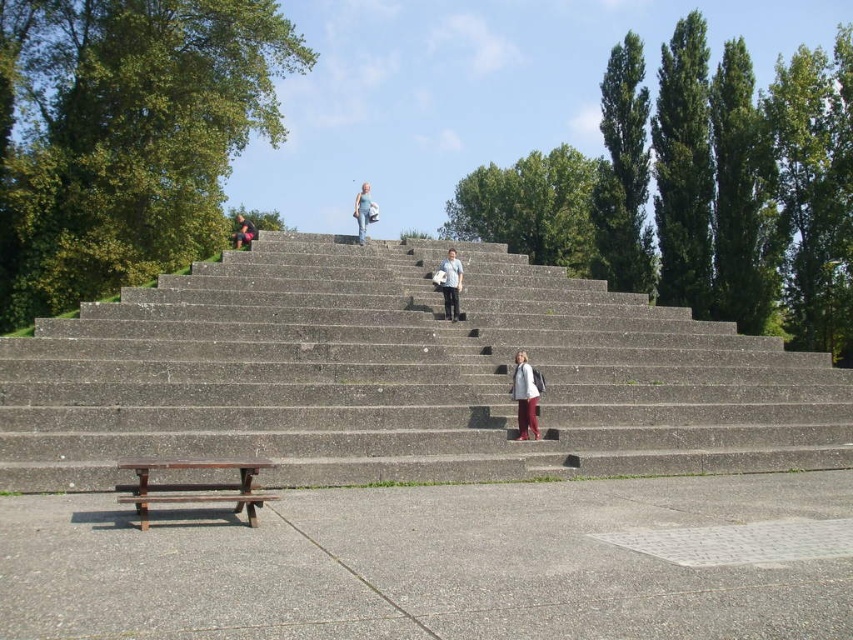
Who is more distant from viewer, (136,492) or (457,312)?

Positioned behind is point (457,312).

Between point (141, 524) and point (457, 280), which one is positioned in front?

Point (141, 524)

Locate an element on the screen. Image resolution: width=853 pixels, height=640 pixels. wooden bench at lower left is located at coordinates click(x=194, y=486).

Is wooden bench at lower left to the left of matte white jacket at center from the viewer's perspective?

Yes, wooden bench at lower left is to the left of matte white jacket at center.

Does wooden bench at lower left have a larger size compared to matte white jacket at center?

Yes.

Does point (199, 484) come closer to viewer compared to point (523, 426)?

Yes, point (199, 484) is closer to viewer.

Identify the location of wooden bench at lower left. This screenshot has width=853, height=640. (194, 486).

Is concrete stairs at center below wooden bench at lower left?

No.

Is concrete stairs at center thinner than wooden bench at lower left?

No, concrete stairs at center is not thinner than wooden bench at lower left.

Is point (549, 305) in front of point (190, 499)?

That is False.

The width and height of the screenshot is (853, 640). Find the location of `concrete stairs at center`. concrete stairs at center is located at coordinates (402, 376).